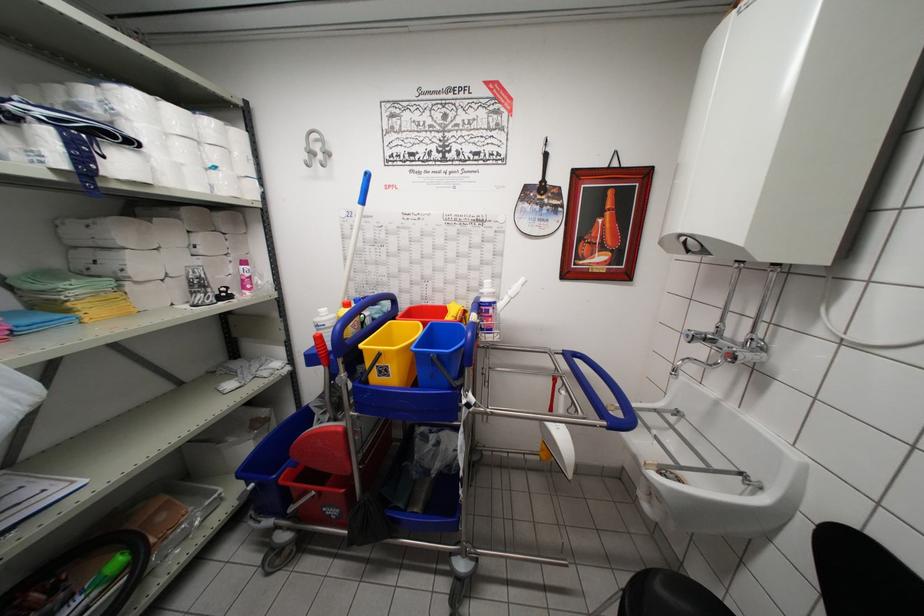
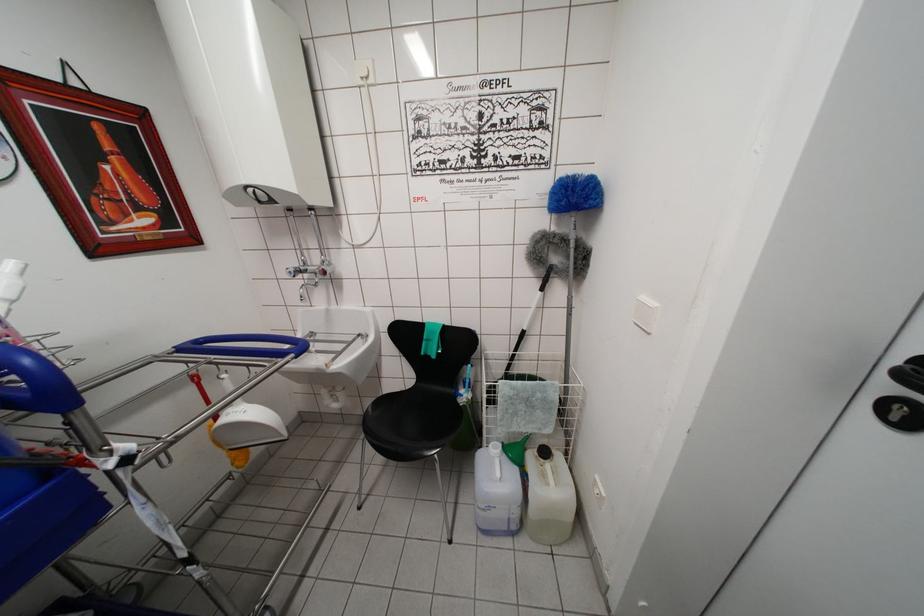
The point at (477, 326) is marked in the first image. Where is the corresponding point in the second image?

(5, 349)